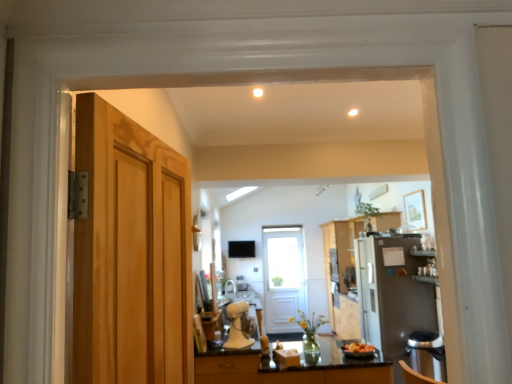
The height and width of the screenshot is (384, 512). Describe the element at coordinates (131, 253) in the screenshot. I see `light brown wood door at left, marked as the first door in a top-to-bottom arrangement` at that location.

Locate an element on the screen. light brown wood door at left, marked as the first door in a top-to-bottom arrangement is located at coordinates (131, 253).

The height and width of the screenshot is (384, 512). What do you see at coordinates (341, 275) in the screenshot? I see `wooden cabinet at center` at bounding box center [341, 275].

What do you see at coordinates (426, 354) in the screenshot?
I see `black plastic dishwasher at lower right` at bounding box center [426, 354].

In order to face white matte stand mixer at center, the first appliance from the left, should I rotate leftwards or rightwards?

It's best to rotate left around 1.791 degrees.

Describe the element at coordinates (393, 292) in the screenshot. I see `satin silver refrigerator at right, placed as the first appliance when sorted from back to front` at that location.

What is the approximate width of black marble countertop at lower center?

36.83 inches.

This screenshot has width=512, height=384. I want to click on black marble countertop at lower center, so click(x=291, y=368).

You are a GUI agent. You are given a task and a screenshot of the screen. Output one action in this format:
    pyautogui.click(x=<x>, y=<y>)
    Task: Click on the light brown wood door at left, the first door when ordered from front to back
    
    Given the screenshot: What is the action you would take?
    pyautogui.click(x=131, y=253)

In the image, there is a black marble countertop at lower center. Where is `dish washer below it (from a real-world perspective)`? This screenshot has height=384, width=512. dish washer below it (from a real-world perspective) is located at coordinates (426, 354).

Is black plastic dishwasher at lower right at the back of black marble countertop at lower center?

That's not correct — black marble countertop at lower center is not looking away from black plastic dishwasher at lower right.

From the picture: Considering the relative sizes of black marble countertop at lower center and black plastic dishwasher at lower right in the image provided, is black marble countertop at lower center wider than black plastic dishwasher at lower right?

Yes, black marble countertop at lower center is wider than black plastic dishwasher at lower right.

Is white matte stand mixer at center, which is counted as the 2th appliance, starting from the back, inside wooden cabinet at center?

No.

Does wooden cabinet at center have a lesser width compared to white matte stand mixer at center, which is counted as the 2th appliance, starting from the back?

No, wooden cabinet at center is not thinner than white matte stand mixer at center, which is counted as the 2th appliance, starting from the back.

From a real-world perspective, which is physically above, wooden cabinet at center or white matte stand mixer at center, the first appliance from the left?

From a 3D spatial view, wooden cabinet at center is above.

Consider the image. Which of these two, wooden cabinet at center or white matte stand mixer at center, the second appliance positioned from the right, stands shorter?

white matte stand mixer at center, the second appliance positioned from the right.

Locate an element on the screen. cabinetry on the right side of black marble countertop at lower center is located at coordinates (341, 275).

Considering the positions of objects wooden cabinet at center and black marble countertop at lower center in the image provided, who is in front, wooden cabinet at center or black marble countertop at lower center?

black marble countertop at lower center is more forward.

Is point (356, 332) in front of point (260, 355)?

No.

Can you tell me how much wooden cabinet at center and black marble countertop at lower center differ in facing direction?

The facing directions of wooden cabinet at center and black marble countertop at lower center are 90 degrees apart.

Visually, is black marble countertop at lower center positioned to the left or to the right of white wooden door at center, positioned as the first door in bottom-to-top order?

Clearly, black marble countertop at lower center is on the left of white wooden door at center, positioned as the first door in bottom-to-top order, in the image.

Is black marble countertop at lower center beside white wooden door at center, placed as the 2th door when sorted from front to back?

No, black marble countertop at lower center is not beside white wooden door at center, placed as the 2th door when sorted from front to back.

Is black marble countertop at lower center bigger than white wooden door at center, which is counted as the 1th door, starting from the right?

Yes.

Is black marble countertop at lower center shorter than white wooden door at center, positioned as the first door in bottom-to-top order?

Yes.

From a real-world perspective, which is physically above, white matte stand mixer at center, the first appliance in the front-to-back sequence, or wooden cabinet at center?

From a 3D spatial view, wooden cabinet at center is above.

How distant is white matte stand mixer at center, the second appliance positioned from the right, from wooden cabinet at center?

7.43 feet.

What are the coordinates of `appliance that is the 1st one below the wooden cabinet at center (from a real-world perspective)` in the screenshot? It's located at (237, 326).

Does wooden cabinet at center lie in front of black plastic dishwasher at lower right?

That is False.

Is wooden cabinet at center far from black plastic dishwasher at lower right?

Yes, wooden cabinet at center and black plastic dishwasher at lower right are located far from each other.

Can you confirm if wooden cabinet at center is shorter than black plastic dishwasher at lower right?

No.

Measure the distance from light brown wood door at left, which appears as the 2th door when viewed from the right, to black plastic dishwasher at lower right.

light brown wood door at left, which appears as the 2th door when viewed from the right, and black plastic dishwasher at lower right are 1.56 meters apart.

Do you think light brown wood door at left, the first door when ordered from front to back, is within black plastic dishwasher at lower right, or outside of it?

The correct answer is: outside.

Is light brown wood door at left, which appears as the 2th door when viewed from the right, oriented towards black plastic dishwasher at lower right?

No, light brown wood door at left, which appears as the 2th door when viewed from the right, is not turned towards black plastic dishwasher at lower right.

From a real-world perspective, relative to black plastic dishwasher at lower right, is light brown wood door at left, the first door from the left, vertically above or below?

light brown wood door at left, the first door from the left, is situated higher than black plastic dishwasher at lower right in the real world.

This screenshot has height=384, width=512. I want to click on countertop located above the black plastic dishwasher at lower right (from the image's perspective), so click(291, 368).

Locate an element on the screen. The width and height of the screenshot is (512, 384). cabinetry behind the white matte stand mixer at center, the first appliance from the left is located at coordinates point(341,275).

Based on the photo, from the image, which object appears to be farther from wooden cabinet at center, light brown wood door at left, the first door when ordered from front to back, or black plastic dishwasher at lower right?

light brown wood door at left, the first door when ordered from front to back, is positioned further to the anchor wooden cabinet at center.

From the picture: Looking at the image, which one is located further to wooden cabinet at center, satin silver refrigerator at right, placed as the 2th appliance when sorted from front to back, or black marble countertop at lower center?

black marble countertop at lower center is positioned further to the anchor wooden cabinet at center.

Based on their spatial positions, is multicolored plastic bowl at center or white matte stand mixer at center, the first appliance from the left, closer to light brown wood door at left, which appears as the 2th door when viewed from the right?

Based on the image, white matte stand mixer at center, the first appliance from the left, appears to be nearer to light brown wood door at left, which appears as the 2th door when viewed from the right.

Considering their positions, is black plastic dishwasher at lower right positioned closer to satin silver refrigerator at right, placed as the 2th appliance when sorted from front to back, than black marble countertop at lower center?

black marble countertop at lower center lies closer to satin silver refrigerator at right, placed as the 2th appliance when sorted from front to back, than the other object.

Considering their positions, is multicolored plastic bowl at center positioned closer to wooden cabinet at center than satin silver refrigerator at right, placed as the 2th appliance when sorted from front to back?

satin silver refrigerator at right, placed as the 2th appliance when sorted from front to back, is closer to wooden cabinet at center.

From the image, which object appears to be farther from satin silver refrigerator at right, placed as the first appliance when sorted from back to front, multicolored plastic bowl at center or white wooden door at center, which is counted as the 2th door, starting from the left?

Based on the image, white wooden door at center, which is counted as the 2th door, starting from the left, appears to be further to satin silver refrigerator at right, placed as the first appliance when sorted from back to front.

Looking at the image, which one is located further to black marble countertop at lower center, satin silver refrigerator at right, placed as the first appliance when sorted from back to front, or wooden cabinet at center?

wooden cabinet at center lies further to black marble countertop at lower center than the other object.

When comparing their distances from wooden cabinet at center, does light brown wood door at left, arranged as the second door when ordered from the bottom, or white matte stand mixer at center, which is counted as the 2th appliance, starting from the back, seem further?

light brown wood door at left, arranged as the second door when ordered from the bottom, lies further to wooden cabinet at center than the other object.

The height and width of the screenshot is (384, 512). What are the coordinates of `countertop located between white matte stand mixer at center, the second appliance positioned from the right, and black plastic dishwasher at lower right in the left-right direction` in the screenshot? It's located at (291, 368).

The width and height of the screenshot is (512, 384). Find the location of `countertop between light brown wood door at left, placed as the second door when sorted from back to front, and white matte stand mixer at center, the first appliance from the left, from front to back`. countertop between light brown wood door at left, placed as the second door when sorted from back to front, and white matte stand mixer at center, the first appliance from the left, from front to back is located at coordinates (291, 368).

Image resolution: width=512 pixels, height=384 pixels. Find the location of `appliance located between white matte stand mixer at center, which is counted as the 2th appliance, starting from the back, and white wooden door at center, which is counted as the 2th door, starting from the left, in the depth direction`. appliance located between white matte stand mixer at center, which is counted as the 2th appliance, starting from the back, and white wooden door at center, which is counted as the 2th door, starting from the left, in the depth direction is located at coordinates (393, 292).

I want to click on dish washer positioned between light brown wood door at left, the first door when ordered from front to back, and wooden cabinet at center from near to far, so [426, 354].